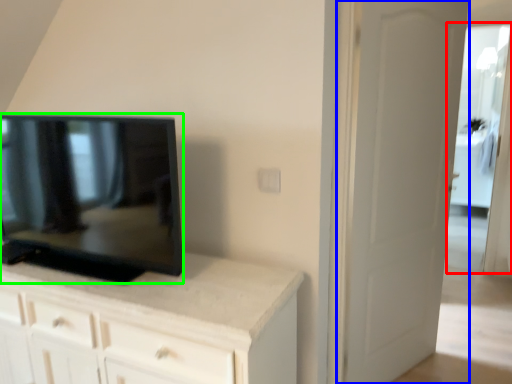
Question: Which is farther away from glass door (highlighted by a red box)? door (highlighted by a blue box) or television (highlighted by a green box)?

Choices:
 (A) door
 (B) television

Answer: (B)